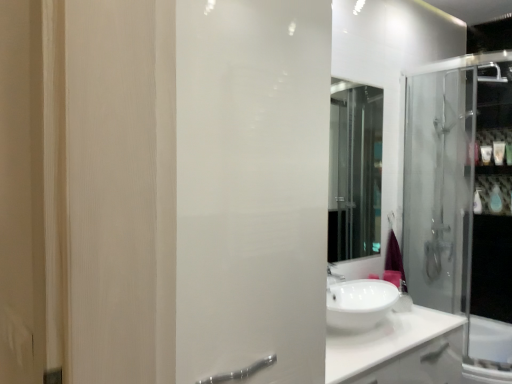
Question: Should I look upward or downward to see white glossy soap at upper right, acting as the 3th toiletry starting from the bottom?

Choices:
 (A) up
 (B) down

Answer: (A)

Question: Is white glossy counter top at center completely or partially outside of white glossy soap at upper right, acting as the 3th toiletry starting from the bottom?

Choices:
 (A) no
 (B) yes

Answer: (B)

Question: Is white glossy counter top at center touching white glossy soap at upper right, acting as the 3th toiletry starting from the bottom?

Choices:
 (A) yes
 (B) no

Answer: (B)

Question: Can you confirm if white glossy counter top at center is taller than white glossy soap at upper right, which ranks as the third toiletry in top-to-bottom order?

Choices:
 (A) yes
 (B) no

Answer: (A)

Question: Is white glossy counter top at center positioned in front of white glossy soap at upper right, which ranks as the third toiletry in top-to-bottom order?

Choices:
 (A) yes
 (B) no

Answer: (A)

Question: Does white glossy counter top at center appear on the right side of white glossy soap at upper right, acting as the 3th toiletry starting from the bottom?

Choices:
 (A) yes
 (B) no

Answer: (B)

Question: Considering the relative sizes of white glossy counter top at center and white glossy soap at upper right, which ranks as the third toiletry in top-to-bottom order, in the image provided, is white glossy counter top at center wider than white glossy soap at upper right, which ranks as the third toiletry in top-to-bottom order,?

Choices:
 (A) yes
 (B) no

Answer: (A)

Question: From a real-world perspective, does white glossy bottle at right, marked as the fifth toiletry in a top-to-bottom arrangement, stand above white glossy bottle at upper right, the 5th toiletry when ordered from bottom to top?

Choices:
 (A) yes
 (B) no

Answer: (B)

Question: Is white glossy bottle at right, which ranks as the first toiletry in bottom-to-top order, next to white glossy bottle at upper right, the 5th toiletry when ordered from bottom to top, and touching it?

Choices:
 (A) no
 (B) yes

Answer: (A)

Question: Does white glossy bottle at right, which ranks as the first toiletry in bottom-to-top order, turn towards white glossy bottle at upper right, the first toiletry when ordered from top to bottom?

Choices:
 (A) no
 (B) yes

Answer: (A)

Question: From a real-world perspective, is white glossy bottle at right, marked as the fifth toiletry in a top-to-bottom arrangement, beneath white glossy bottle at upper right, the 5th toiletry when ordered from bottom to top?

Choices:
 (A) no
 (B) yes

Answer: (B)

Question: Is white glossy bottle at right, marked as the fifth toiletry in a top-to-bottom arrangement, further to camera compared to white glossy bottle at upper right, the first toiletry when ordered from top to bottom?

Choices:
 (A) yes
 (B) no

Answer: (B)

Question: Can you confirm if white glossy bottle at right, marked as the fifth toiletry in a top-to-bottom arrangement, is positioned to the left of white glossy bottle at upper right, the 5th toiletry when ordered from bottom to top?

Choices:
 (A) no
 (B) yes

Answer: (A)

Question: Considering the relative sizes of white glossy bottle at upper right, the 5th toiletry when ordered from bottom to top, and white frosted glass screen door at center in the image provided, is white glossy bottle at upper right, the 5th toiletry when ordered from bottom to top, thinner than white frosted glass screen door at center?

Choices:
 (A) no
 (B) yes

Answer: (B)